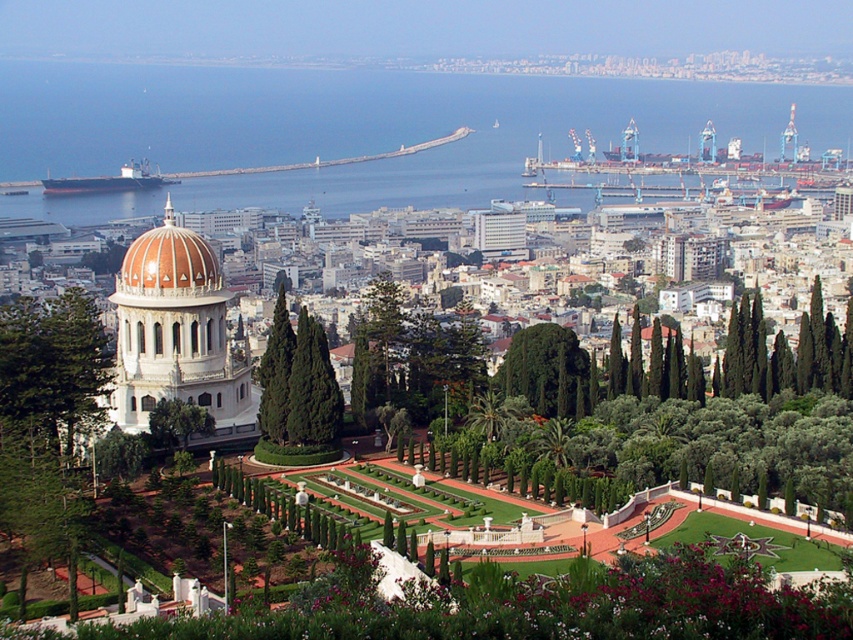
Question: Based on their relative distances, which object is farther from the matte orange dome at center?

Choices:
 (A) blue water at center
 (B) green leafy tree at center

Answer: (A)

Question: Which object is positioned closest to the blue water at center?

Choices:
 (A) green textured tree at center
 (B) green leafy tree at center-left

Answer: (A)

Question: Which point appears closest to the camera in this image?

Choices:
 (A) (151, 314)
 (B) (151, 77)
 (C) (305, 419)

Answer: (C)

Question: Is blue water at center below green textured tree at center?

Choices:
 (A) no
 (B) yes

Answer: (A)

Question: Does white marble dome at left have a larger size compared to green textured tree at center?

Choices:
 (A) yes
 (B) no

Answer: (A)

Question: Is white marble dome at left thinner than matte orange dome at center?

Choices:
 (A) no
 (B) yes

Answer: (A)